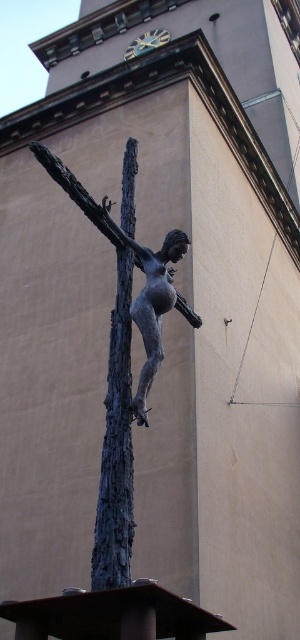
Between point (138, 252) and point (111, 227), which one is positioned behind?

The point (138, 252) is more distant.

Which is behind, point (54, 163) or point (146, 339)?

The point (146, 339) is more distant.

The width and height of the screenshot is (300, 640). In order to click on bronze statue at center in this screenshot , I will do `click(138, 266)`.